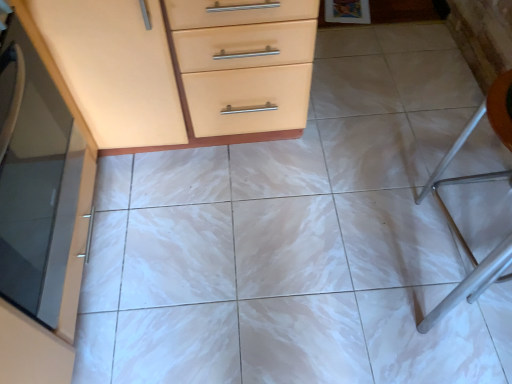
Locate an element on the screen. vacant space underneath orange plastic folding chair at right (from a real-world perspective) is located at coordinates (462, 234).